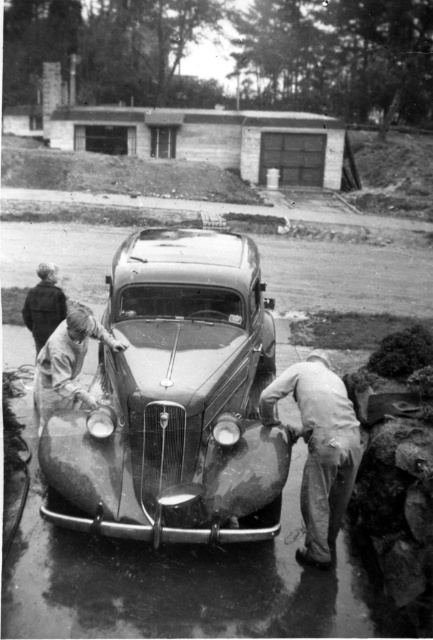
Question: Does light gray fabric pants at lower right have a larger size compared to dark brown leather jacket at upper left?

Choices:
 (A) yes
 (B) no

Answer: (A)

Question: Which point is closer to the camera?

Choices:
 (A) (84, 336)
 (B) (239, 515)
 (C) (55, 321)
 (D) (317, 420)

Answer: (B)

Question: Does polished metal car at center come in front of light gray fabric pants at lower right?

Choices:
 (A) yes
 (B) no

Answer: (A)

Question: Is polished metal car at center above light brown leather jacket at front center?

Choices:
 (A) no
 (B) yes

Answer: (B)

Question: Among these objects, which one is farthest from the camera?

Choices:
 (A) dark brown leather jacket at upper left
 (B) polished metal car at center
 (C) light gray fabric pants at lower right
 (D) light brown leather jacket at front center

Answer: (A)

Question: Which point is farther from the camera taking this photo?

Choices:
 (A) (32, 333)
 (B) (84, 339)
 (C) (203, 228)

Answer: (C)